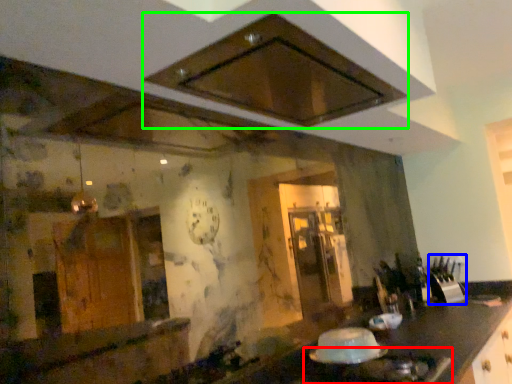
Question: Considering the real-world distances, which object is closest to gas stove (highlighted by a red box)? appliance (highlighted by a blue box) or exhaust hood (highlighted by a green box).

Choices:
 (A) appliance
 (B) exhaust hood

Answer: (B)